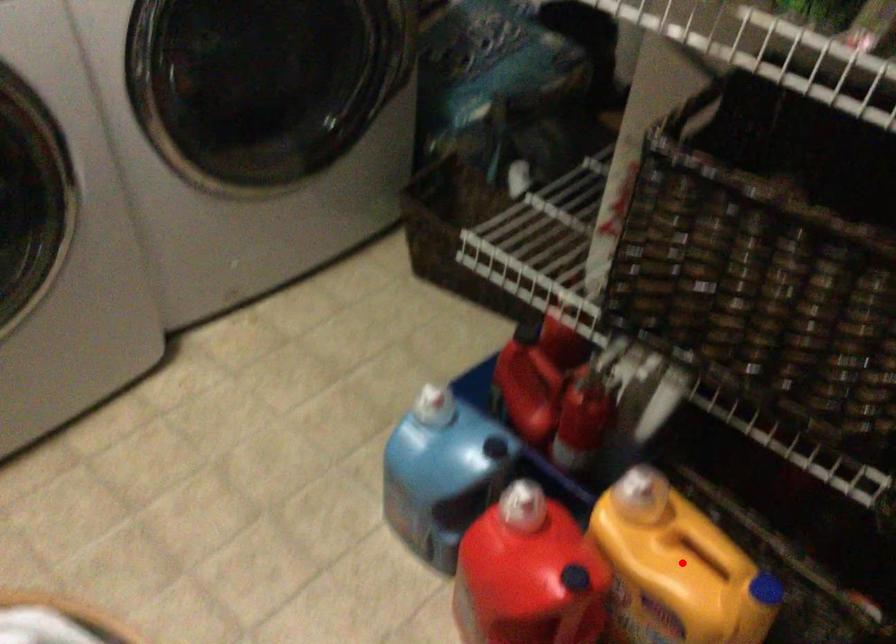
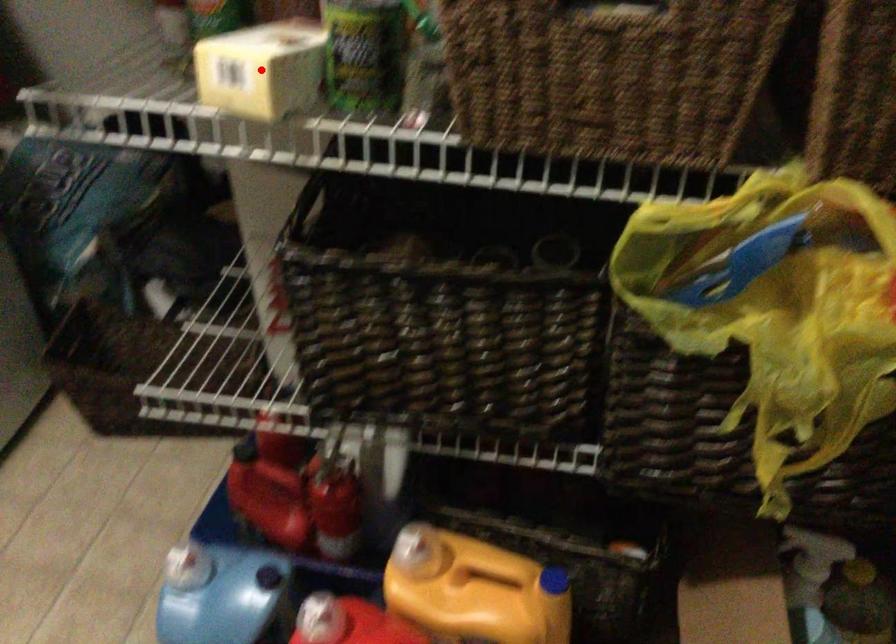
I am providing you with two images of the same scene from different viewpoints. A red point is marked on the first image and another point is marked on the second image. Is the marked point in image1 the same physical position as the marked point in image2?

No